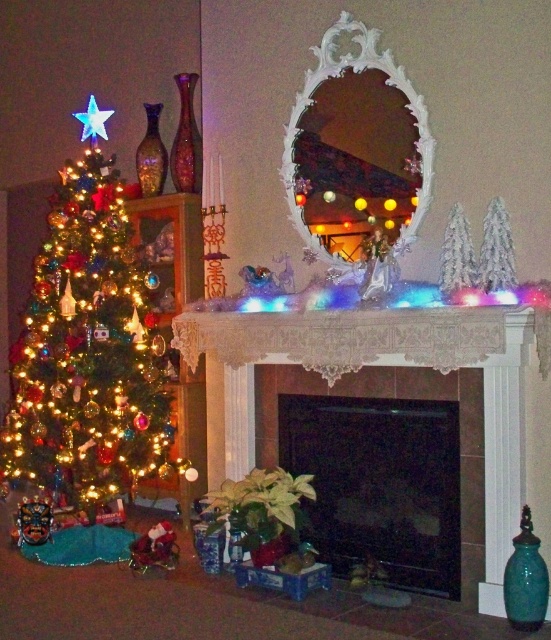
Who is shorter, white lace fireplace at center or white lace mantel at upper center?

Standing shorter between the two is white lace mantel at upper center.

What do you see at coordinates (359, 378) in the screenshot? The image size is (551, 640). I see `white lace fireplace at center` at bounding box center [359, 378].

Identify the location of white lace fireplace at center. The image size is (551, 640). (359, 378).

Is point (145, 445) more distant than point (349, 397)?

Yes.

Based on the photo, can you confirm if shiny multicolored ornaments at left is positioned to the right of black glass fireplace at center?

No, shiny multicolored ornaments at left is not to the right of black glass fireplace at center.

Does point (109, 243) come farther from viewer compared to point (445, 499)?

Yes, it is.

You are a GUI agent. You are given a task and a screenshot of the screen. Output one action in this format:
    pyautogui.click(x=<x>, y=<y>)
    Task: Click on the shiny multicolored ornaments at left
    The image size is (551, 640).
    Given the screenshot: What is the action you would take?
    pyautogui.click(x=89, y=349)

Is black glass fireplace at center smaller than white ornate mirror at center?

Result: No.

The image size is (551, 640). In order to click on black glass fireplace at center in this screenshot , I will do `click(380, 484)`.

You are a GUI agent. You are given a task and a screenshot of the screen. Output one action in this format:
    pyautogui.click(x=<x>, y=<y>)
    Task: Click on the black glass fireplace at center
    Image resolution: width=551 pixels, height=640 pixels.
    Given the screenshot: What is the action you would take?
    pyautogui.click(x=380, y=484)